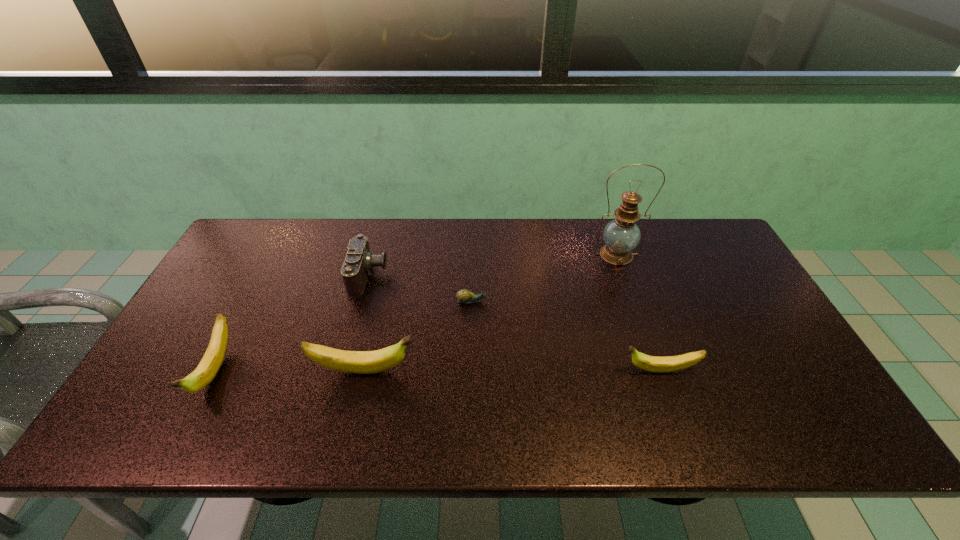
I want to click on vacant region at the near edge of the desktop, so click(727, 403).

You are a GUI agent. You are given a task and a screenshot of the screen. Output one action in this format:
    pyautogui.click(x=<x>, y=<y>)
    Task: Click on the blank space at the left edge
    The height and width of the screenshot is (540, 960).
    Given the screenshot: What is the action you would take?
    pyautogui.click(x=207, y=327)

This screenshot has height=540, width=960. In order to click on free space at the right edge in this screenshot , I will do `click(714, 319)`.

This screenshot has height=540, width=960. Find the location of `vacant space at the far left corner of the desktop`. vacant space at the far left corner of the desktop is located at coordinates (289, 235).

You are a GUI agent. You are given a task and a screenshot of the screen. Output one action in this format:
    pyautogui.click(x=<x>, y=<y>)
    Task: Click on the vacant area at the near right corner
    
    Given the screenshot: What is the action you would take?
    pyautogui.click(x=750, y=378)

Identify the location of free space between the tallest object and the camera. (492, 265).

Find the location of a particular element. free area in between the shortest banana and the tallest object is located at coordinates (637, 313).

Identify the location of free space between the rightmost banana and the fourth object from left to right. (565, 336).

Image resolution: width=960 pixels, height=540 pixels. Identify the location of unoccupied area between the camera and the rightmost banana. (514, 323).

In order to click on vacant space in between the tallest object and the camera in this screenshot , I will do `click(492, 265)`.